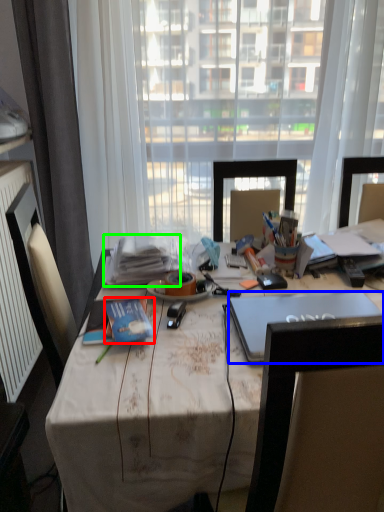
Question: Which object is positioned farthest from book (highlighted by a red box)? Select from laptop (highlighted by a blue box) and book (highlighted by a green box).

Choices:
 (A) laptop
 (B) book

Answer: (A)